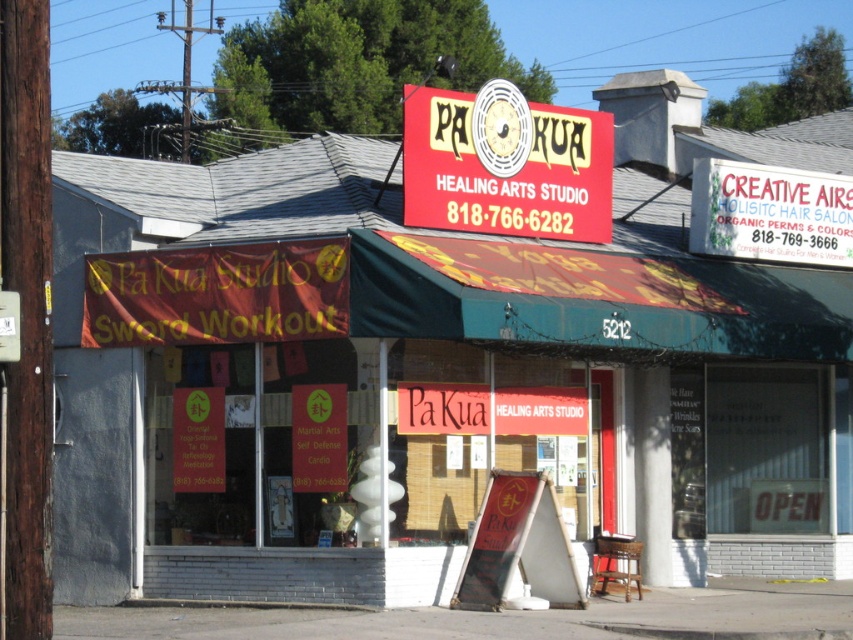
Can you confirm if red plastic sign at center is positioned below white plastic sign at upper right?

Incorrect, red plastic sign at center is not positioned below white plastic sign at upper right.

Does red plastic sign at center lie in front of white plastic sign at upper right?

Yes, red plastic sign at center is in front of white plastic sign at upper right.

Who is more distant from viewer, (495, 221) or (849, 205)?

Point (849, 205)

Find the location of a particular element. red plastic sign at center is located at coordinates (506, 164).

Is the position of red plastic sign at center more distant than that of matte red sign at center?

Yes, red plastic sign at center is further from the viewer.

Measure the distance between red plastic sign at center and matte red sign at center.

red plastic sign at center is 9.89 feet away from matte red sign at center.

The image size is (853, 640). What do you see at coordinates (506, 164) in the screenshot?
I see `red plastic sign at center` at bounding box center [506, 164].

Locate an element on the screen. red plastic sign at center is located at coordinates (506, 164).

Is white plastic sign at upper right to the left of matte red sign at center from the viewer's perspective?

Incorrect, white plastic sign at upper right is not on the left side of matte red sign at center.

Between point (732, 234) and point (518, 496), which one is positioned behind?

The point (732, 234) is behind.

Where is `white plastic sign at upper right`? This screenshot has width=853, height=640. white plastic sign at upper right is located at coordinates (770, 212).